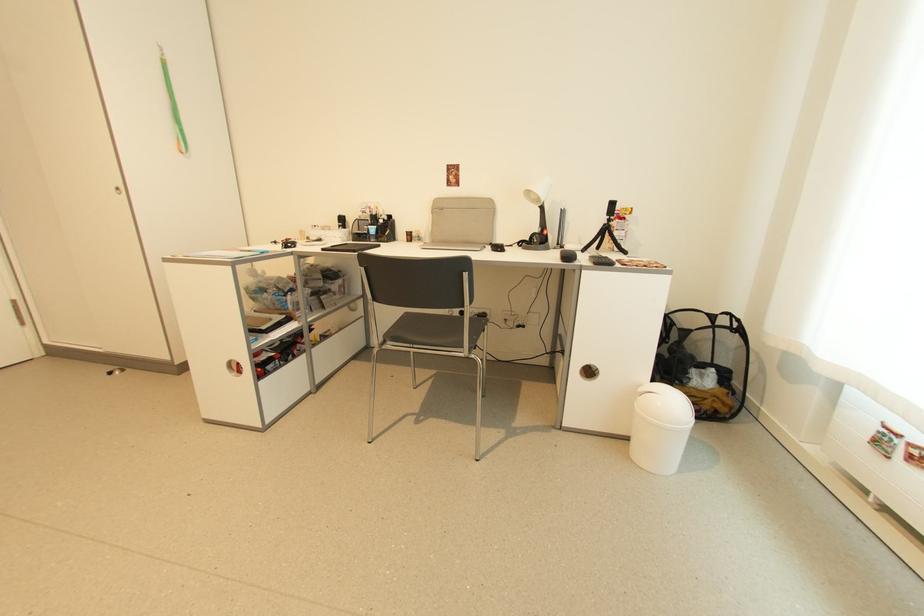
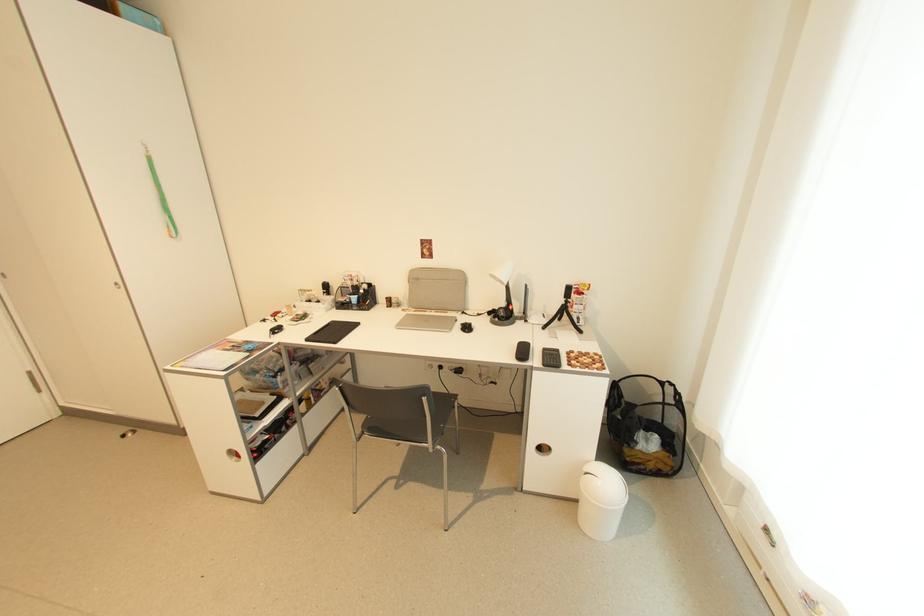
In the second image, find the point that corresponds to [541,232] in the first image.

(507, 306)